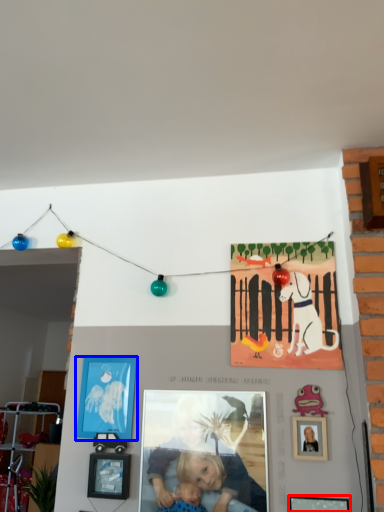
Question: Among these objects, which one is nearest to the camera, picture frame (highlighted by a red box) or picture frame (highlighted by a blue box)?

Choices:
 (A) picture frame
 (B) picture frame

Answer: (A)